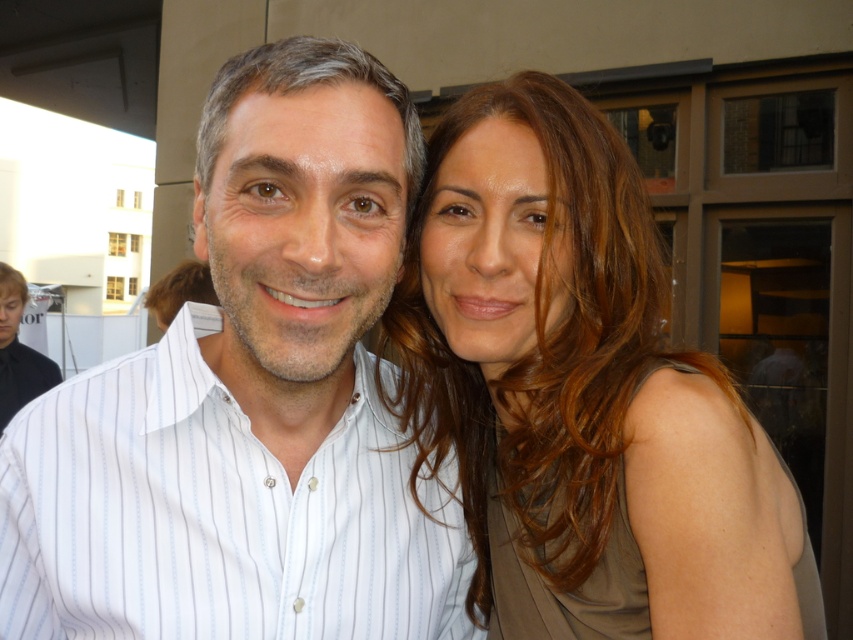
Does point (360, 236) lie in front of point (511, 442)?

Yes, it is.

Between point (376, 435) and point (494, 218), which one is positioned behind?

Point (376, 435)

Measure the distance between white striped shirt at center and camera.

white striped shirt at center and camera are 29.81 inches apart.

Find the location of a particular element. The width and height of the screenshot is (853, 640). white striped shirt at center is located at coordinates (251, 401).